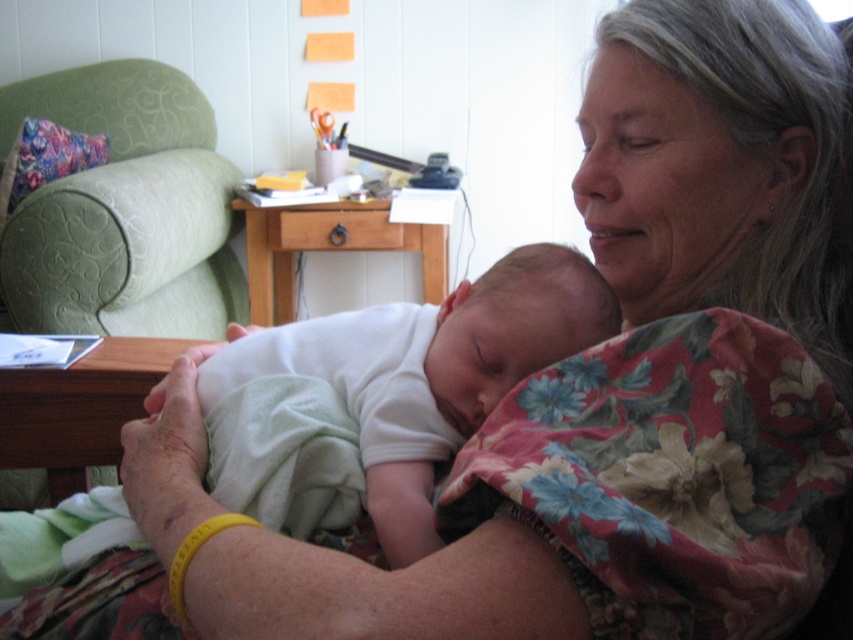
You are designing a nursery and want to place the white soft fabric newborn at center in the green fabric armchair at left. Based on their sizes, will the newborn fit comfortably in the armchair?

The green fabric armchair at left is wider than the white soft fabric newborn at center, so the newborn will fit comfortably in the armchair.

You are a photographer setting up a shoot in the room. You need to position a small camera stand that is 1.2 meters tall. The stand must be placed near an object that is taller than the stand. Which object between the green fabric armchair at left and the white soft fabric newborn at center should you choose?

The green fabric armchair at left is taller than the white soft fabric newborn at center, so you should place the camera stand near the green fabric armchair at left since it is taller than the stand.

You are standing in the living room and need to place a small potted plant on the green fabric armchair at left. Is the armchair positioned to the left side of the room?

The green fabric armchair at left is located at point 0.330 on the x and 0.145 on the y, so yes, it is positioned to the left side of the room.